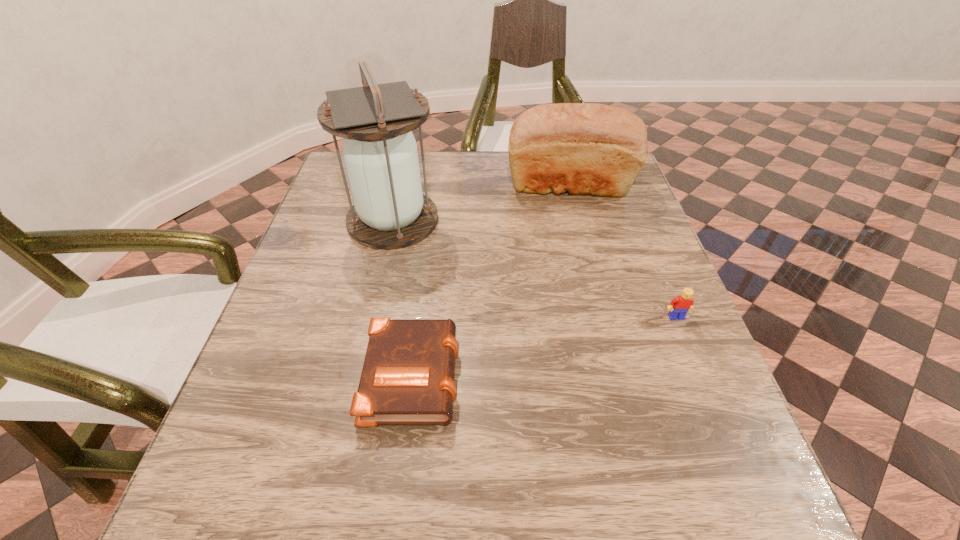
You are a GUI agent. You are given a task and a screenshot of the screen. Output one action in this format:
    pyautogui.click(x=<x>, y=<y>)
    Task: Click on the free space between the lantern and the second tallest object
    The width and height of the screenshot is (960, 540).
    Given the screenshot: What is the action you would take?
    pyautogui.click(x=481, y=202)

Locate an element on the screen. free space between the tallest object and the Bible is located at coordinates (403, 296).

Select which object appears as the second closest to the third farthest object. Please provide its 2D coordinates. Your answer should be formatted as a tuple, i.e. [(x, y)], where the tuple contains the x and y coordinates of a point satisfying the conditions above.

[(407, 378)]

Locate which object ranks in proximity to the Lego. Please provide its 2D coordinates. Your answer should be formatted as a tuple, i.e. [(x, y)], where the tuple contains the x and y coordinates of a point satisfying the conditions above.

[(584, 148)]

In order to click on vacant space that satisfies the following two spatial constraints: 1. on the face of the Lego; 2. on the spine side of the nearest object in this screenshot , I will do `click(699, 373)`.

The width and height of the screenshot is (960, 540). What are the coordinates of `vacant region that satisfies the following two spatial constraints: 1. on the front side of the second tallest object; 2. on the spine side of the shortest object` in the screenshot? It's located at (617, 373).